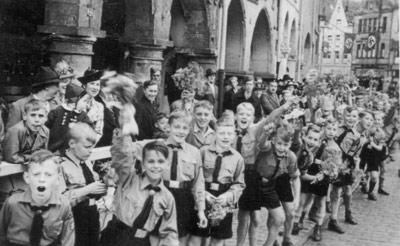
This screenshot has height=246, width=400. Find the location of `columns`. columns is located at coordinates click(x=80, y=36), click(x=142, y=36), click(x=212, y=49).